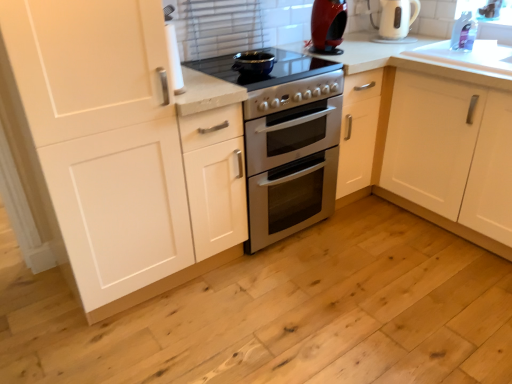
Question: Is white glossy oven at center, acting as the first appliance starting from the bottom, positioned behind white matte cabinet at left?

Choices:
 (A) yes
 (B) no

Answer: (A)

Question: Is white glossy oven at center, acting as the first appliance starting from the bottom, touching white matte cabinet at left?

Choices:
 (A) yes
 (B) no

Answer: (B)

Question: Can we say white glossy oven at center, acting as the first appliance starting from the bottom, lies outside white matte cabinet at left?

Choices:
 (A) no
 (B) yes

Answer: (B)

Question: From a real-world perspective, does white glossy oven at center, acting as the first appliance starting from the bottom, sit lower than white matte cabinet at left?

Choices:
 (A) yes
 (B) no

Answer: (A)

Question: From the image's perspective, is white glossy oven at center, acting as the first appliance starting from the bottom, on top of white matte cabinet at left?

Choices:
 (A) yes
 (B) no

Answer: (A)

Question: Considering their positions, is white glossy electric kettle at upper right located in front of or behind transparent plastic window screen at upper right?

Choices:
 (A) behind
 (B) front

Answer: (A)

Question: Choose the correct answer: Is white glossy electric kettle at upper right inside transparent plastic window screen at upper right or outside it?

Choices:
 (A) inside
 (B) outside

Answer: (B)

Question: Is white glossy electric kettle at upper right bigger or smaller than transparent plastic window screen at upper right?

Choices:
 (A) big
 (B) small

Answer: (A)

Question: From the image's perspective, is white glossy electric kettle at upper right positioned above or below transparent plastic window screen at upper right?

Choices:
 (A) below
 (B) above

Answer: (A)

Question: Choose the correct answer: Is white glossy electric kettle at upper right inside shiny red coffee machine at upper center or outside it?

Choices:
 (A) outside
 (B) inside

Answer: (A)

Question: Considering their positions, is white glossy electric kettle at upper right located in front of or behind shiny red coffee machine at upper center?

Choices:
 (A) front
 (B) behind

Answer: (B)

Question: Is white glossy electric kettle at upper right wider or thinner than shiny red coffee machine at upper center?

Choices:
 (A) wide
 (B) thin

Answer: (A)

Question: From a real-world perspective, is white glossy electric kettle at upper right positioned above or below shiny red coffee machine at upper center?

Choices:
 (A) below
 (B) above

Answer: (A)

Question: From a real-world perspective, relative to white glossy countertop at upper right, is transparent plastic window screen at upper right vertically above or below?

Choices:
 (A) below
 (B) above

Answer: (B)

Question: Based on their sizes in the image, would you say transparent plastic window screen at upper right is bigger or smaller than white glossy countertop at upper right?

Choices:
 (A) big
 (B) small

Answer: (B)